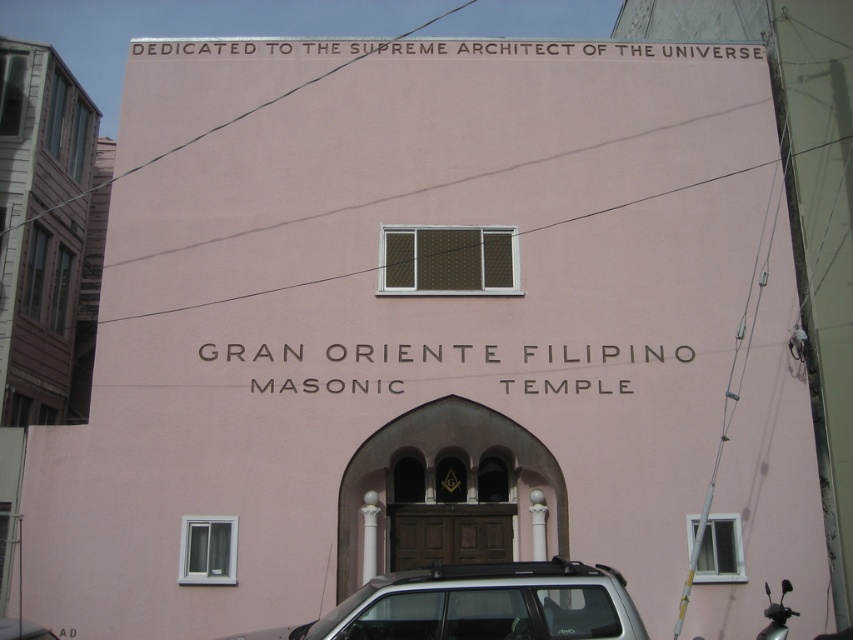
Find the location of `silver metallic suv at lower center`. silver metallic suv at lower center is located at coordinates point(480,604).

Looking at this image, does silver metallic suv at lower center come behind metallic silver motorcycle at lower right?

No, silver metallic suv at lower center is in front of metallic silver motorcycle at lower right.

Does point (404, 608) lie in front of point (782, 628)?

That is True.

Locate an element on the screen. The width and height of the screenshot is (853, 640). silver metallic suv at lower center is located at coordinates (480, 604).